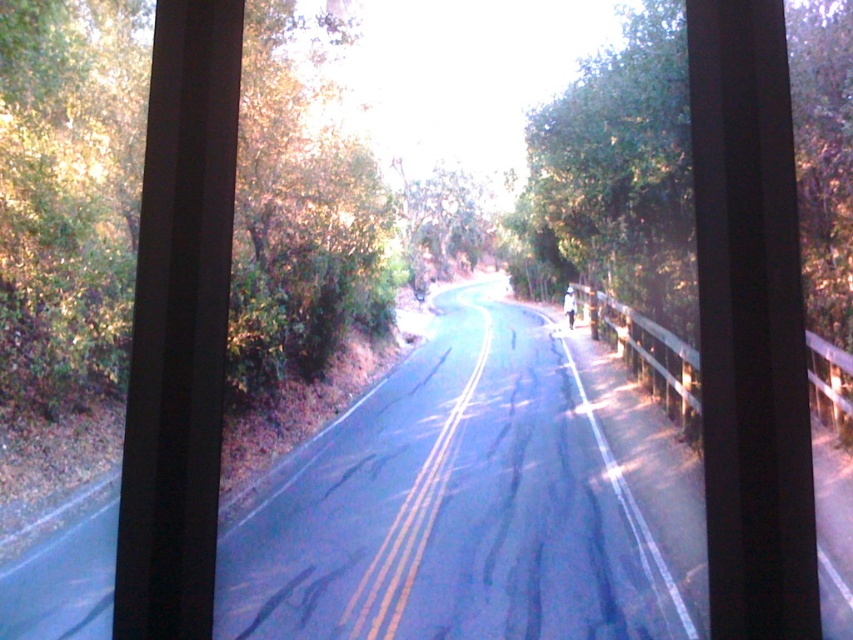
You are a passenger in the car and notice two green leafy trees outside the window. The green leafy tree at right and the green leafy tree at upper left. Based on their sizes, which one is closer to the car?

The green leafy tree at right is larger in size than the green leafy tree at upper left, so the green leafy tree at right is closer to the car.

You are a driver approaching a narrow road section. You see a green leafy tree at upper left and a green leafy tree at center. Which tree would you need to avoid hitting if you stay in the middle of the road?

The green leafy tree at center is wider than the green leafy tree at upper left, so staying in the middle of the road would require avoiding the wider green leafy tree at center to prevent collision.

You are a passenger in the car and notice two green leafy trees outside the window. The green leafy tree at right and the green leafy tree at center. Which one appears taller from your viewpoint?

The green leafy tree at right is taller than the green leafy tree at center.